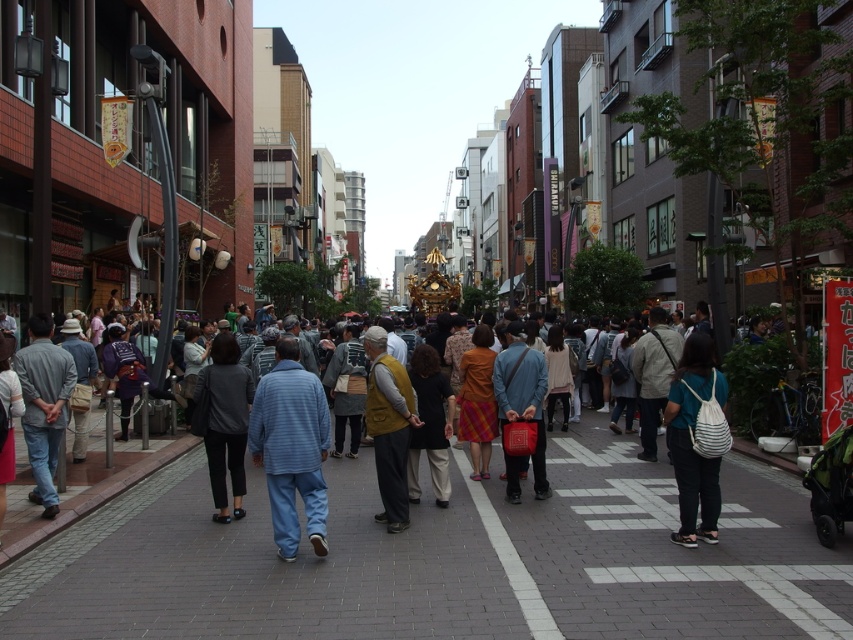
Consider the image. Does blue striped shirt at center have a smaller size compared to striped fabric backpack at center?

Actually, blue striped shirt at center might be larger than striped fabric backpack at center.

Between point (291, 378) and point (709, 492), which one is positioned in front?

Positioned in front is point (291, 378).

The image size is (853, 640). Identify the location of blue striped shirt at center. (291, 448).

This screenshot has height=640, width=853. What are the coordinates of `blue striped shirt at center` in the screenshot? It's located at coord(291,448).

Between brick pavement at center and mustard yellow vest at center, which one appears on the right side from the viewer's perspective?

brick pavement at center is more to the right.

At what (x,y) coordinates should I click in order to perform the action: click on brick pavement at center. Please return your answer as a coordinate pair (x, y). Looking at the image, I should click on (445, 561).

You are a GUI agent. You are given a task and a screenshot of the screen. Output one action in this format:
    pyautogui.click(x=<x>, y=<y>)
    Task: Click on the brick pavement at center
    The image size is (853, 640).
    Given the screenshot: What is the action you would take?
    pyautogui.click(x=445, y=561)

Looking at this image, is blue striped shirt at center wider than matte red bag at center?

Yes, blue striped shirt at center is wider than matte red bag at center.

Identify the location of blue striped shirt at center. This screenshot has height=640, width=853. (291, 448).

Locate an element on the screen. blue striped shirt at center is located at coordinates (291, 448).

Find the location of a particular element. blue striped shirt at center is located at coordinates (291, 448).